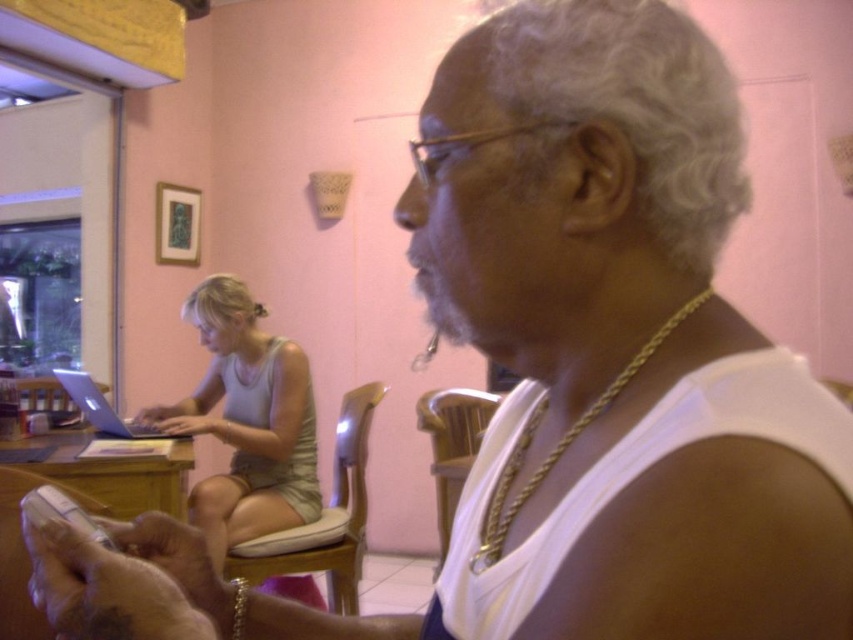
Question: Where is light purple tank top at center located in relation to matte purple laptop at left in the image?

Choices:
 (A) above
 (B) below

Answer: (B)

Question: Which object is closer to the camera taking this photo?

Choices:
 (A) matte purple laptop at left
 (B) light purple tank top at center

Answer: (B)

Question: Which point is closer to the camera taking this photo?

Choices:
 (A) (250, 387)
 (B) (146, 426)

Answer: (B)

Question: Is light purple tank top at center to the right of matte purple laptop at left from the viewer's perspective?

Choices:
 (A) yes
 (B) no

Answer: (A)

Question: From the image, what is the correct spatial relationship of light purple tank top at center in relation to matte purple laptop at left?

Choices:
 (A) right
 (B) left

Answer: (A)